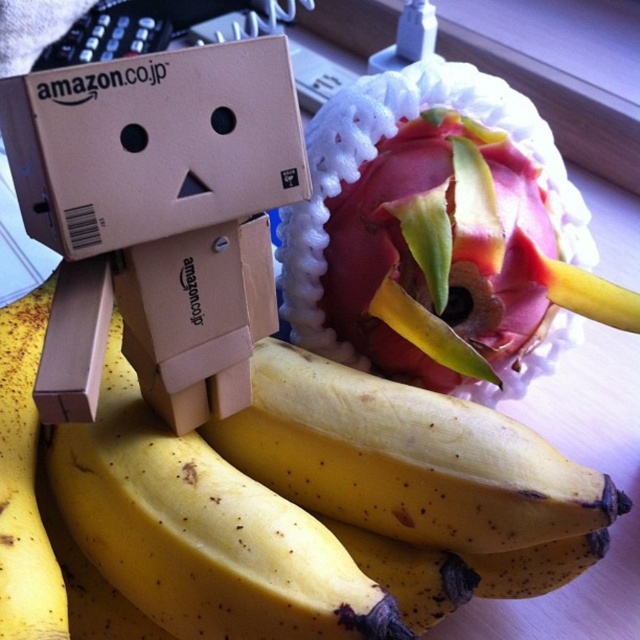
Is yellow matte banana at center in front of pinkish-red flesh with green leaves at center?

That is True.

Can you confirm if yellow matte banana at center is positioned below pinkish-red flesh with green leaves at center?

Yes.

Is point (314, 515) positioned after point (428, 154)?

No.

You are a GUI agent. You are given a task and a screenshot of the screen. Output one action in this format:
    pyautogui.click(x=<x>, y=<y>)
    Task: Click on the yellow matte banana at center
    This screenshot has width=640, height=640.
    Given the screenshot: What is the action you would take?
    pyautogui.click(x=275, y=506)

Can you confirm if brown cardboard box at center is wider than pinkish-red flesh with green leaves at center?

No, brown cardboard box at center is not wider than pinkish-red flesh with green leaves at center.

Between brown cardboard box at center and pinkish-red flesh with green leaves at center, which one is positioned lower?

brown cardboard box at center

Does point (152, 380) lie behind point (410, 156)?

No, it is not.

You are a GUI agent. You are given a task and a screenshot of the screen. Output one action in this format:
    pyautogui.click(x=<x>, y=<y>)
    Task: Click on the brown cardboard box at center
    The height and width of the screenshot is (640, 640).
    Given the screenshot: What is the action you would take?
    pyautogui.click(x=157, y=218)

Between yellow matte banana at center and brown cardboard box at center, which one has less height?

With less height is yellow matte banana at center.

Can you confirm if yellow matte banana at center is smaller than brown cardboard box at center?

Incorrect, yellow matte banana at center is not smaller in size than brown cardboard box at center.

The width and height of the screenshot is (640, 640). What do you see at coordinates (275, 506) in the screenshot?
I see `yellow matte banana at center` at bounding box center [275, 506].

The width and height of the screenshot is (640, 640). Identify the location of yellow matte banana at center. (275, 506).